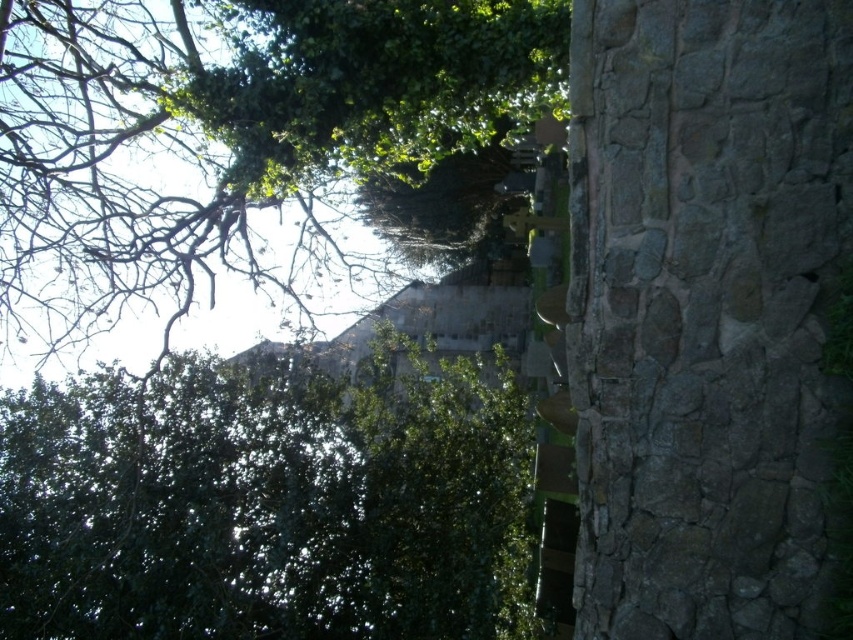
You are standing at the center of the image and want to walk towards the gray stone wall at right. In which direction should you move?

You should move to the right because the gray stone wall at right is located at point 0.484 on the x axis, which is to the right of the center position.

You are standing in the cemetery scene and want to take a photo of both the green leafy tree at upper left and the green leafy tree at upper center. Which tree should you position closer to the front of your photo to include both in the frame?

You should position the green leafy tree at upper left closer to the front of your photo because it is located below the green leafy tree at upper center, meaning it is physically closer to the viewer.

You are a landscape architect planning to install a new pathway between the gray stone wall at right and the green leafy tree at upper left. The pathway requires a minimum of 5 meters of space. Can the existing distance accommodate this requirement?

The gray stone wall at right and green leafy tree at upper left are 5.21 meters apart from each other, which exceeds the required 5 meters. Therefore, the pathway can be installed between them.